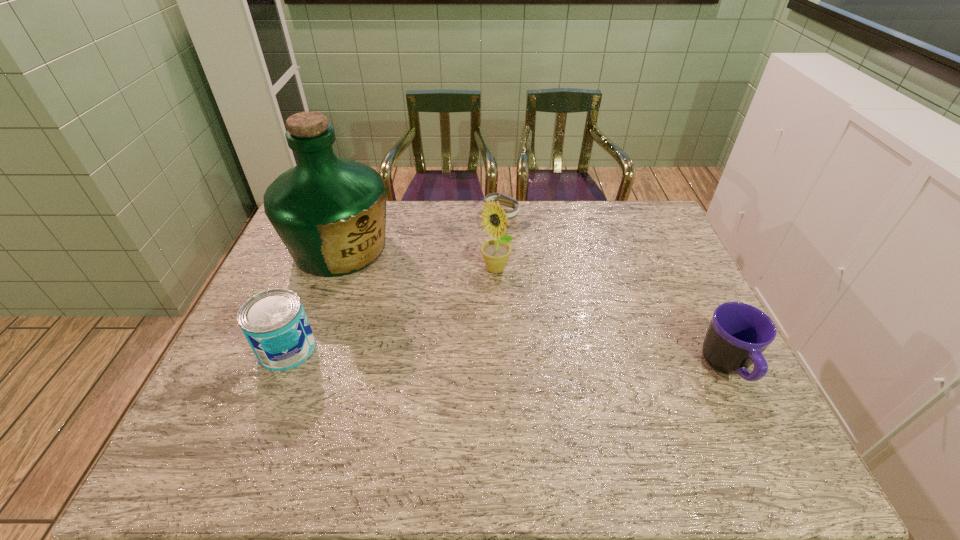
The image size is (960, 540). I want to click on free space between the mug and the liquor, so click(x=534, y=308).

At what (x,y) coordinates should I click in order to perform the action: click on the closest object to the shortest object. Please return your answer as a coordinate pair (x, y). Looking at the image, I should click on (496, 253).

The width and height of the screenshot is (960, 540). What are the coordinates of `object that is the second closest to the can` in the screenshot? It's located at (496, 253).

This screenshot has width=960, height=540. In order to click on free space that satisfies the following two spatial constraints: 1. on the front side of the tallest object; 2. on the left side of the sunflower in this screenshot , I will do `click(332, 269)`.

Where is `free space that satisfies the following two spatial constraints: 1. on the back side of the sunflower; 2. on the left side of the can`? The width and height of the screenshot is (960, 540). free space that satisfies the following two spatial constraints: 1. on the back side of the sunflower; 2. on the left side of the can is located at coordinates (319, 269).